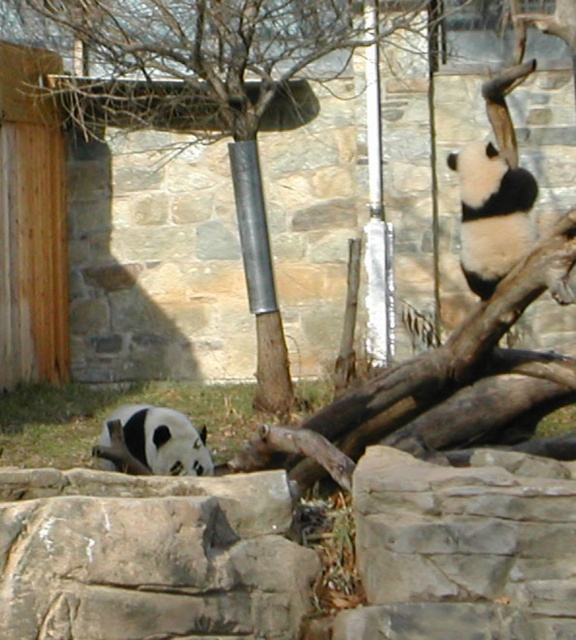
Can you confirm if smooth brown tree trunk at center is positioned to the right of black and white fur at upper right?

No, smooth brown tree trunk at center is not to the right of black and white fur at upper right.

Which is more to the right, smooth brown tree trunk at center or black and white fur at upper right?

Positioned to the right is black and white fur at upper right.

Does point (98, 96) come in front of point (471, 156)?

No.

The height and width of the screenshot is (640, 576). What are the coordinates of `smooth brown tree trunk at center` in the screenshot? It's located at (207, 96).

Can you confirm if smooth brown tree trunk at center is taller than black and white fur panda at lower left?

Indeed, smooth brown tree trunk at center has a greater height compared to black and white fur panda at lower left.

Is smooth brown tree trunk at center smaller than black and white fur panda at lower left?

No, smooth brown tree trunk at center is not smaller than black and white fur panda at lower left.

The width and height of the screenshot is (576, 640). What do you see at coordinates (207, 96) in the screenshot?
I see `smooth brown tree trunk at center` at bounding box center [207, 96].

This screenshot has height=640, width=576. I want to click on smooth brown tree trunk at center, so click(x=207, y=96).

Who is higher up, black and white fur at upper right or black and white fur panda at lower left?

black and white fur at upper right is above.

Between black and white fur at upper right and black and white fur panda at lower left, which one has more height?

With more height is black and white fur at upper right.

Does point (458, 154) come in front of point (168, 408)?

Yes, point (458, 154) is closer to viewer.

The height and width of the screenshot is (640, 576). I want to click on black and white fur at upper right, so click(491, 214).